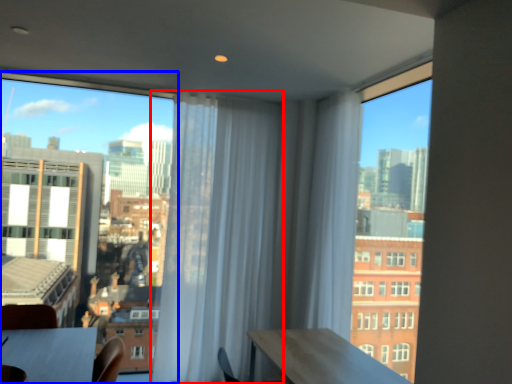
Question: Which object is further to the camera taking this photo, curtain (highlighted by a red box) or window (highlighted by a blue box)?

Choices:
 (A) curtain
 (B) window

Answer: (A)